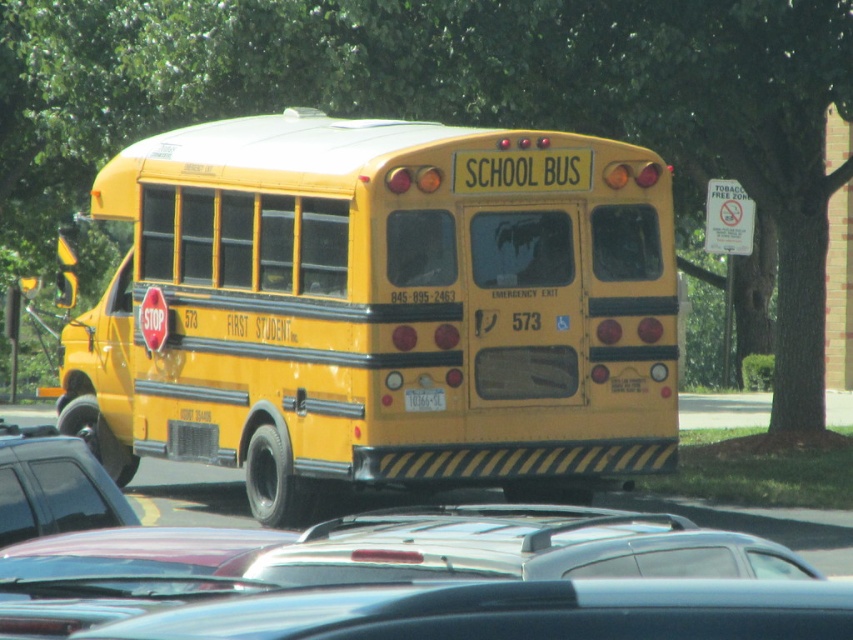
Looking at this image, which of these two, matte yellow school bus at center or yellow matte license plate at center, stands taller?

Standing taller between the two is matte yellow school bus at center.

Who is more forward, (x=453, y=344) or (x=405, y=400)?

Point (x=405, y=400)

At what (x,y) coordinates should I click in order to perform the action: click on matte yellow school bus at center. Please return your answer as a coordinate pair (x, y). The image size is (853, 640). Looking at the image, I should click on (381, 308).

This screenshot has height=640, width=853. Describe the element at coordinates (53, 484) in the screenshot. I see `metallic gray sedan at center` at that location.

Is point (64, 516) positioned after point (434, 392)?

No.

Where is `metallic gray sedan at center`? metallic gray sedan at center is located at coordinates (53, 484).

Between matte yellow school bus at center and metallic gray sedan at center, which one appears on the left side from the viewer's perspective?

Positioned to the left is metallic gray sedan at center.

Describe the element at coordinates (381, 308) in the screenshot. I see `matte yellow school bus at center` at that location.

Is point (380, 227) behind point (74, 528)?

Yes, it is.

Locate an element on the screen. The width and height of the screenshot is (853, 640). matte yellow school bus at center is located at coordinates (381, 308).